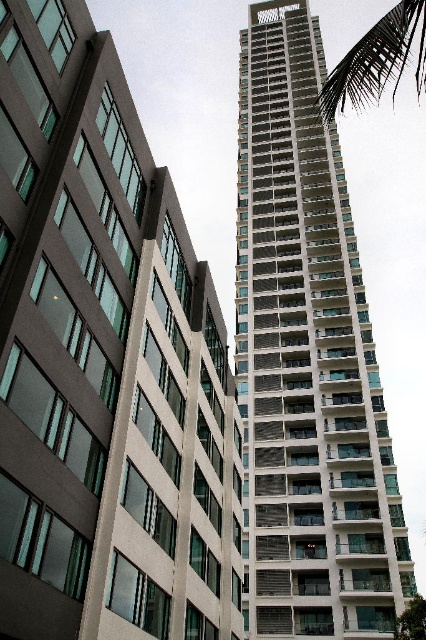
Who is shorter, white glass building at center or green leafy palm tree at upper right?

Standing shorter between the two is white glass building at center.

Is white glass building at center thinner than green leafy palm tree at upper right?

Correct, white glass building at center's width is less than green leafy palm tree at upper right's.

At what (x,y) coordinates should I click in order to perform the action: click on white glass building at center. Please return your answer as a coordinate pair (x, y). The image size is (426, 640). Looking at the image, I should click on (307, 362).

Image resolution: width=426 pixels, height=640 pixels. What are the coordinates of `white glass building at center` in the screenshot? It's located at (307, 362).